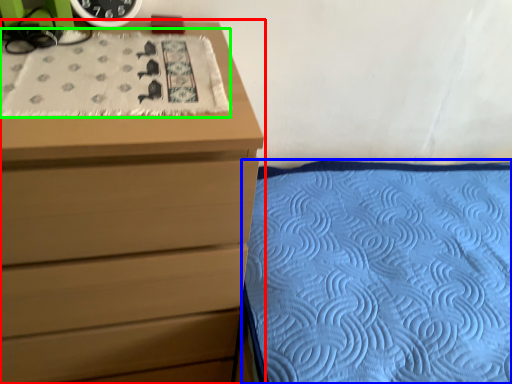
Question: Which object is positioned closest to chest of drawers (highlighted by a red box)? Select from mattress (highlighted by a blue box) and blanket (highlighted by a green box).

Choices:
 (A) mattress
 (B) blanket

Answer: (B)